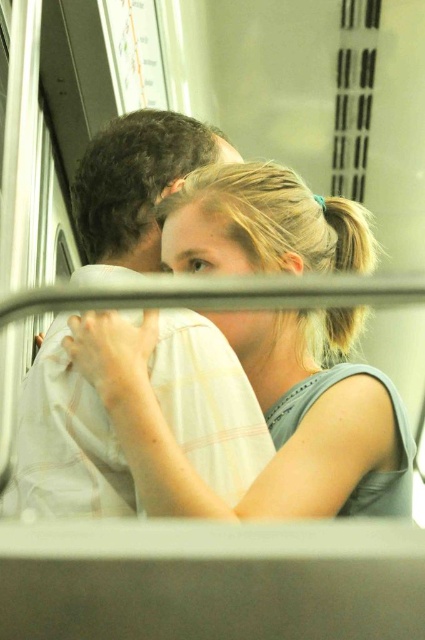
Is light gray fabric shirt at center bigger than white cotton shirt at center?

Yes, light gray fabric shirt at center is bigger than white cotton shirt at center.

Who is more distant from viewer, (265, 509) or (139, 145)?

Point (139, 145)

This screenshot has width=425, height=640. I want to click on light gray fabric shirt at center, so click(x=266, y=419).